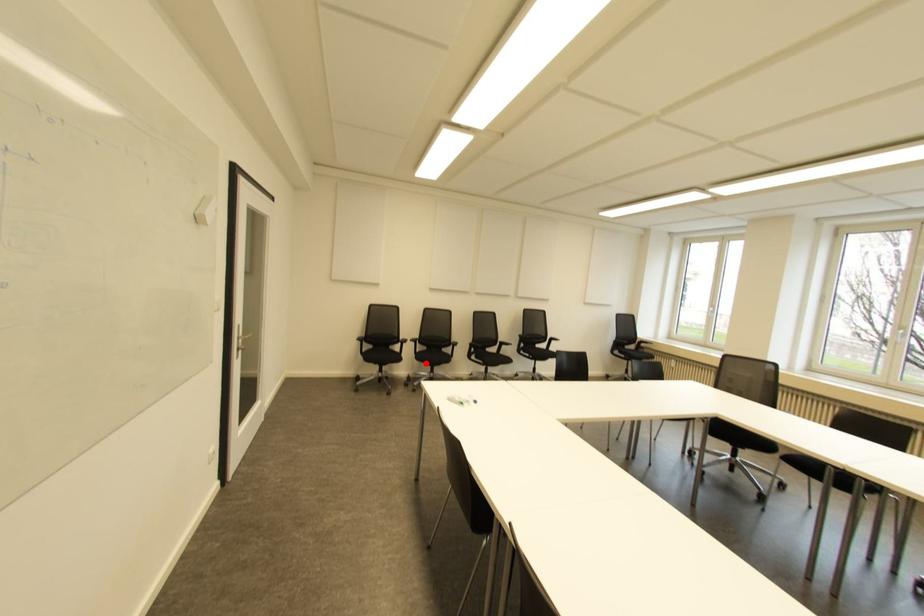
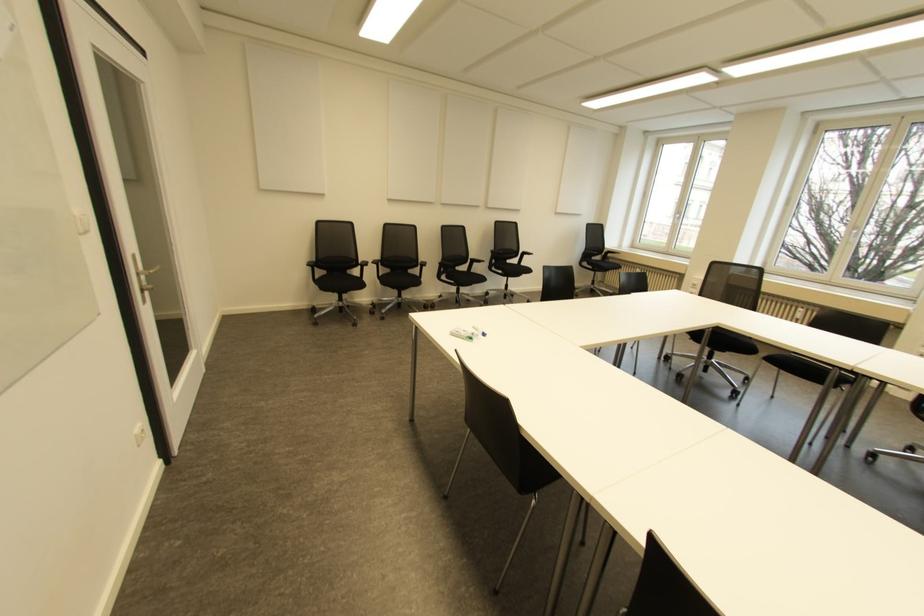
In the second image, find the point that corresponds to the highlighted location in the first image.

(393, 286)